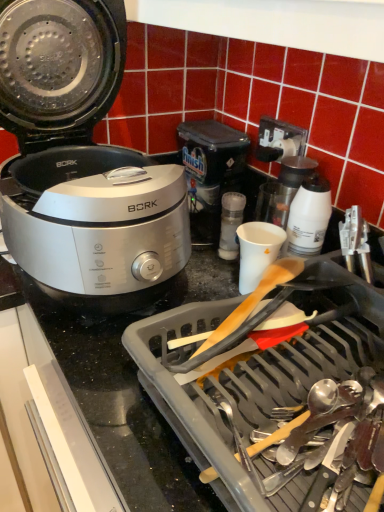
The image size is (384, 512). Describe the element at coordinates (81, 162) in the screenshot. I see `satin silver appliance at upper left` at that location.

In order to face satin silver appliance at upper left, should I rotate leftwards or rightwards?

Turn left approximately 14.284 degrees to face it.

Locate an element on the screen. satin silver appliance at upper left is located at coordinates (81, 162).

Where is `satin silver appliance at upper left`? This screenshot has width=384, height=512. satin silver appliance at upper left is located at coordinates (x=81, y=162).